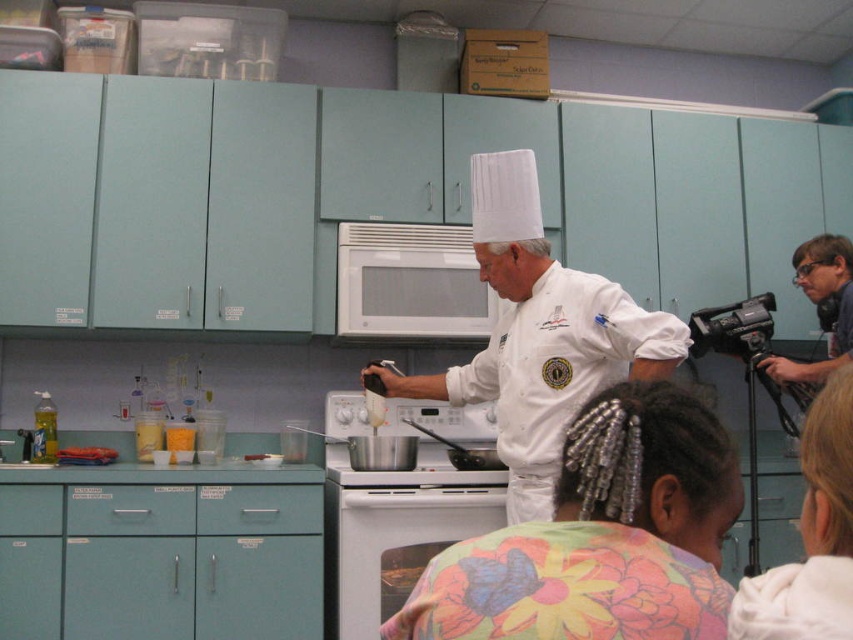
Question: Which of the following is the farthest from the observer?

Choices:
 (A) (426, 234)
 (B) (416, 522)
 (C) (759, 332)
 (D) (642, 413)

Answer: (C)

Question: Which of the following is the farthest from the observer?

Choices:
 (A) white chef hat at upper center
 (B) white glossy oven at lower center
 (C) white matte chef hat at center

Answer: (B)

Question: Which of the following is the farthest from the observer?

Choices:
 (A) (532, 209)
 (B) (337, 497)
 (C) (697, 344)
 (D) (451, 268)

Answer: (C)

Question: Can you confirm if white matte chef hat at center is positioned above black plastic video camera at right?

Choices:
 (A) no
 (B) yes

Answer: (B)

Question: Does white chef hat at upper center come behind black plastic video camera at right?

Choices:
 (A) yes
 (B) no

Answer: (B)

Question: Is white chef hat at upper center thinner than white matte chef hat at center?

Choices:
 (A) no
 (B) yes

Answer: (B)